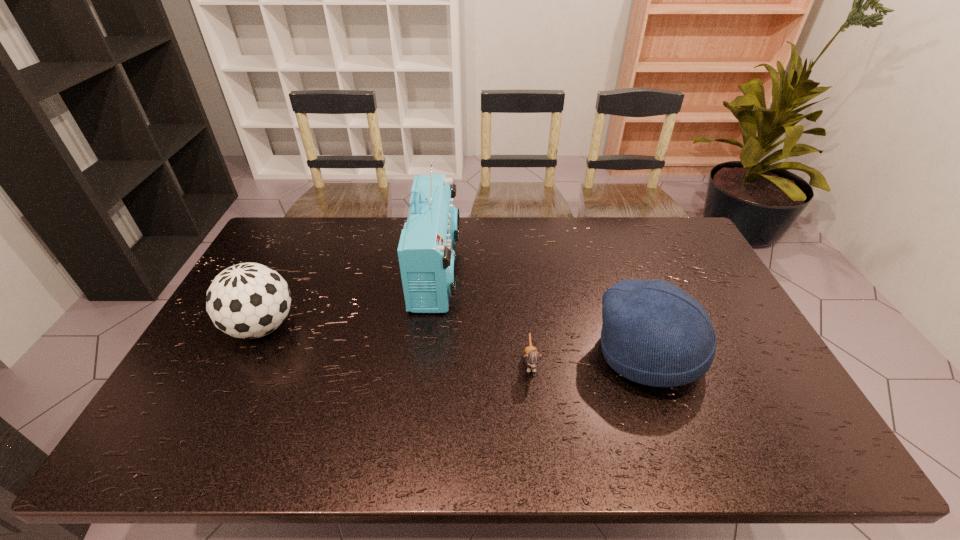
I want to click on the third object from right to left, so click(x=427, y=261).

You are a GUI agent. You are given a task and a screenshot of the screen. Output one action in this format:
    pyautogui.click(x=<x>, y=<y>)
    Task: Click on the tallest object
    
    Given the screenshot: What is the action you would take?
    pyautogui.click(x=427, y=261)

Find the location of a particular element. Image resolution: width=960 pixels, height=540 pixels. the rightmost object is located at coordinates (654, 333).

You are a GUI agent. You are given a task and a screenshot of the screen. Output one action in this format:
    pyautogui.click(x=<x>, y=<y>)
    Task: Click on the soccer ball
    This screenshot has height=540, width=960.
    Given the screenshot: What is the action you would take?
    pyautogui.click(x=249, y=300)

This screenshot has height=540, width=960. In order to click on the second object from right to left in this screenshot , I will do `click(532, 358)`.

Where is `the shortest object`? This screenshot has width=960, height=540. the shortest object is located at coordinates (532, 358).

Where is `free location located 0.100m on the front-facing side of the radio receiver`? The image size is (960, 540). free location located 0.100m on the front-facing side of the radio receiver is located at coordinates (489, 271).

Image resolution: width=960 pixels, height=540 pixels. Find the location of `vacant point located on the back of the skullcap`. vacant point located on the back of the skullcap is located at coordinates (611, 248).

At what (x,y) coordinates should I click in order to perform the action: click on free space located on the back of the soccer ball. Please return your answer as a coordinate pair (x, y). The image size is (960, 540). Looking at the image, I should click on (300, 252).

At what (x,y) coordinates should I click in order to perform the action: click on vacant area located on the front-facing side of the third object from left to right. Please return your answer as a coordinate pair (x, y). Looking at the image, I should click on (536, 414).